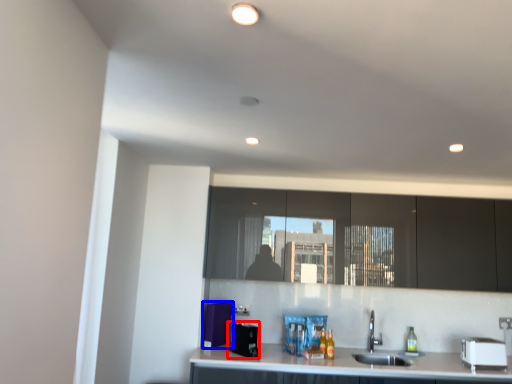
Question: Which object is further to the camera taking this photo, appliance (highlighted by a red box) or appliance (highlighted by a blue box)?

Choices:
 (A) appliance
 (B) appliance

Answer: (B)